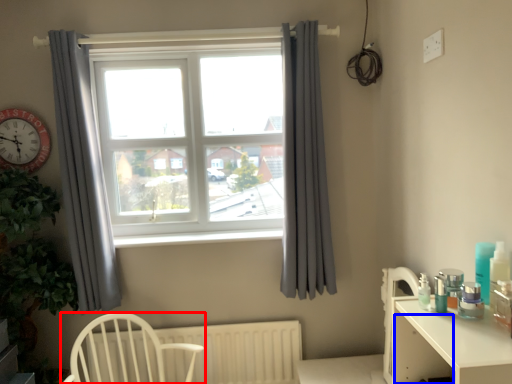
Question: Among these objects, which one is nearest to the camera, chair (highlighted by a red box) or drawer (highlighted by a blue box)?

Choices:
 (A) chair
 (B) drawer

Answer: (B)